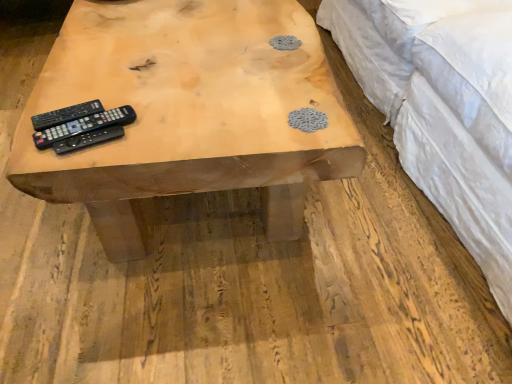
Where is `vacant area that is in front of black matte remote control at center, which is the third remote control from back to front`? The width and height of the screenshot is (512, 384). vacant area that is in front of black matte remote control at center, which is the third remote control from back to front is located at coordinates (78, 157).